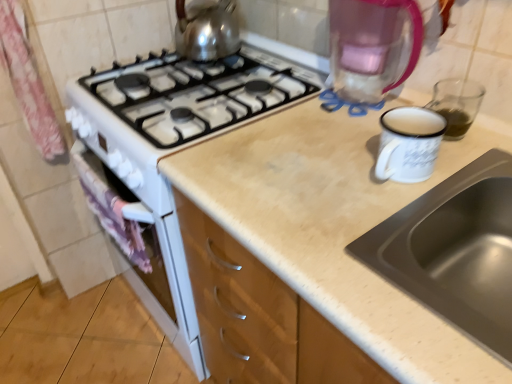
Question: Is stainless steel sink at upper right turned away from pink fabric curtain at left?

Choices:
 (A) yes
 (B) no

Answer: (B)

Question: Is stainless steel sink at upper right completely or partially outside of pink fabric curtain at left?

Choices:
 (A) no
 (B) yes

Answer: (B)

Question: Considering the relative sizes of stainless steel sink at upper right and pink fabric curtain at left in the image provided, is stainless steel sink at upper right taller than pink fabric curtain at left?

Choices:
 (A) no
 (B) yes

Answer: (A)

Question: Is pink fabric curtain at left a part of stainless steel sink at upper right?

Choices:
 (A) yes
 (B) no

Answer: (B)

Question: Can you confirm if stainless steel sink at upper right is bigger than pink fabric curtain at left?

Choices:
 (A) no
 (B) yes

Answer: (B)

Question: Is shiny metallic kettle at upper center in front of or behind green liquid at right in the image?

Choices:
 (A) front
 (B) behind

Answer: (B)

Question: Considering the positions of shiny metallic kettle at upper center and green liquid at right in the image, is shiny metallic kettle at upper center taller or shorter than green liquid at right?

Choices:
 (A) tall
 (B) short

Answer: (A)

Question: Looking at the image, does shiny metallic kettle at upper center seem bigger or smaller compared to green liquid at right?

Choices:
 (A) big
 (B) small

Answer: (A)

Question: In the image, is shiny metallic kettle at upper center on the left side or the right side of green liquid at right?

Choices:
 (A) right
 (B) left

Answer: (B)

Question: In terms of width, does shiny metallic kettle at upper center look wider or thinner when compared to stainless steel sink at upper right?

Choices:
 (A) thin
 (B) wide

Answer: (A)

Question: From a real-world perspective, is shiny metallic kettle at upper center above or below stainless steel sink at upper right?

Choices:
 (A) above
 (B) below

Answer: (A)

Question: Relative to stainless steel sink at upper right, is shiny metallic kettle at upper center in front or behind?

Choices:
 (A) front
 (B) behind

Answer: (B)

Question: From the image's perspective, relative to stainless steel sink at upper right, is shiny metallic kettle at upper center above or below?

Choices:
 (A) below
 (B) above

Answer: (B)

Question: In terms of width, does pink fabric at left look wider or thinner when compared to stainless steel sink at upper right?

Choices:
 (A) wide
 (B) thin

Answer: (B)

Question: Visually, is pink fabric at left positioned to the left or to the right of stainless steel sink at upper right?

Choices:
 (A) left
 (B) right

Answer: (A)